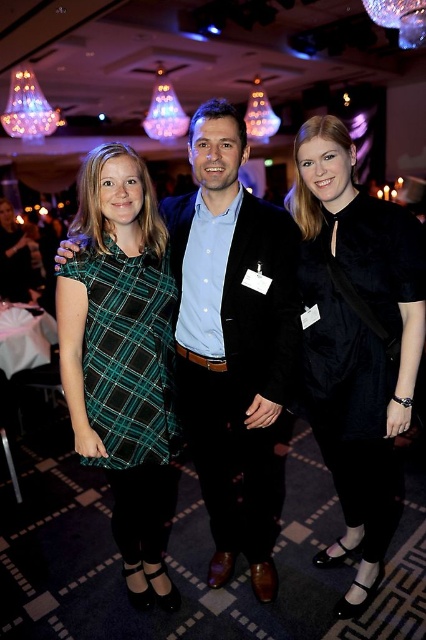
The width and height of the screenshot is (426, 640). Describe the element at coordinates (357, 340) in the screenshot. I see `velvet black dress at center` at that location.

Does point (367, 476) lie behind point (129, 508)?

No.

Where is `velvet black dress at center`? The height and width of the screenshot is (640, 426). velvet black dress at center is located at coordinates (357, 340).

Can you confirm if matte black suit at center is taller than velvet black dress at center?

Yes, matte black suit at center is taller than velvet black dress at center.

Can you confirm if matte black suit at center is smaller than velvet black dress at center?

Actually, matte black suit at center might be larger than velvet black dress at center.

Where is `matte black suit at center`? This screenshot has height=640, width=426. matte black suit at center is located at coordinates (233, 342).

Does matte black suit at center have a greater width compared to green plaid dress at left?

Correct, the width of matte black suit at center exceeds that of green plaid dress at left.

Can you confirm if matte black suit at center is positioned to the right of green plaid dress at left?

Correct, you'll find matte black suit at center to the right of green plaid dress at left.

Image resolution: width=426 pixels, height=640 pixels. Identify the location of matte black suit at center. (233, 342).